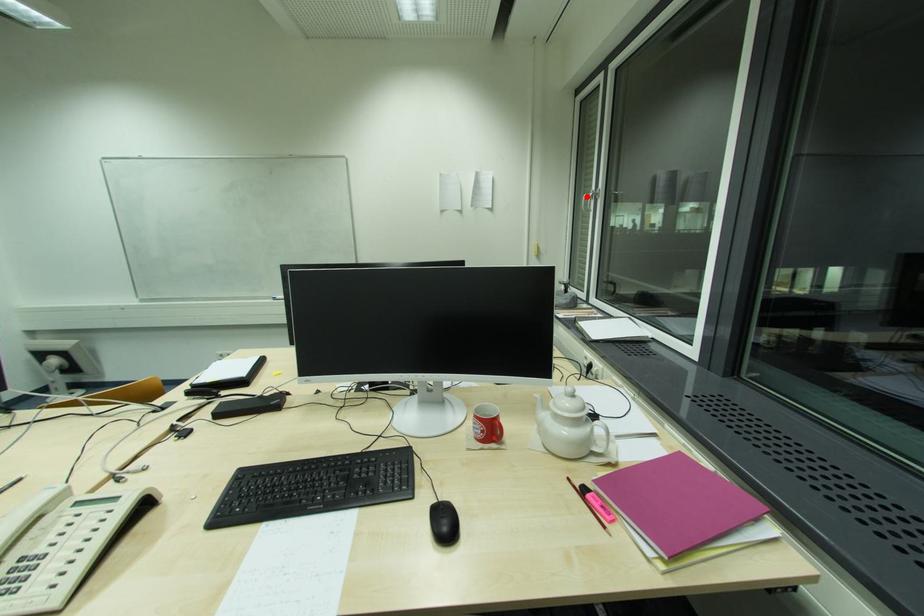
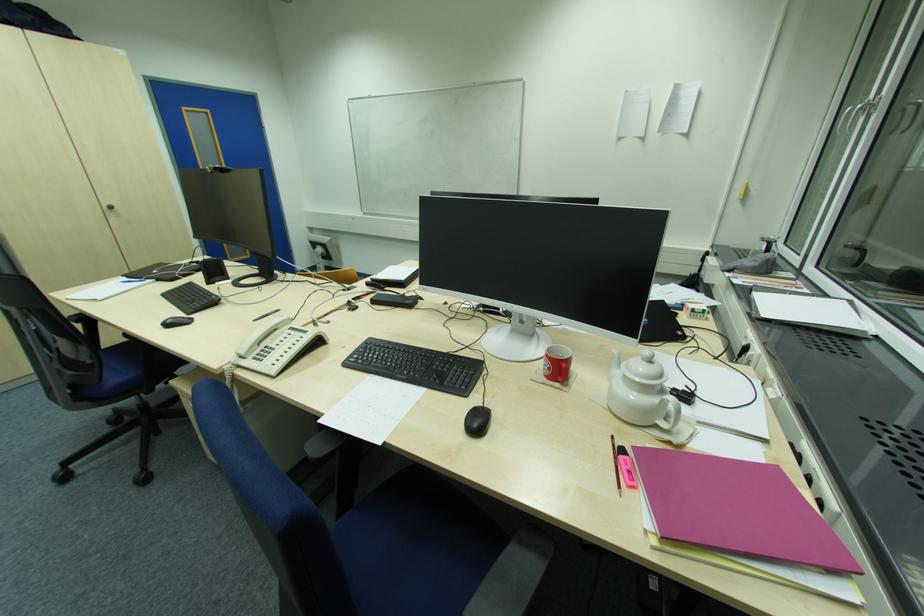
Where in the second image is the point corresponding to the highlighted location from the first image?

(850, 111)